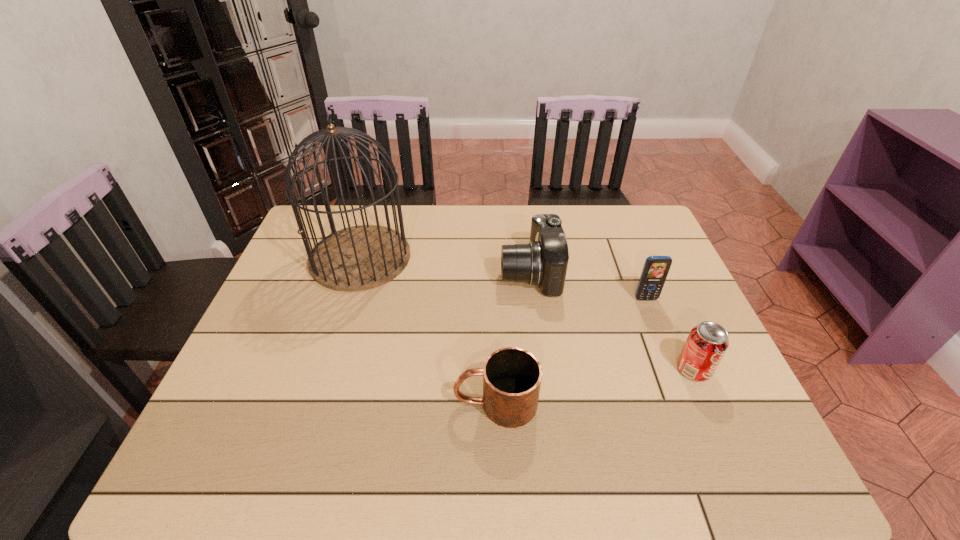
In order to click on birdcage in this screenshot , I will do `click(358, 258)`.

Identify the location of the leftmost object. (358, 258).

Locate an element on the screen. cellular telephone is located at coordinates (656, 268).

Identify the location of camera. Image resolution: width=960 pixels, height=540 pixels. (544, 261).

The height and width of the screenshot is (540, 960). Find the location of `soda can`. soda can is located at coordinates (707, 342).

Locate an element on the screen. Image resolution: width=960 pixels, height=540 pixels. mug is located at coordinates coord(512,376).

Where is `vacant space situated 0.180m at the door of the leftmost object`? The height and width of the screenshot is (540, 960). vacant space situated 0.180m at the door of the leftmost object is located at coordinates (333, 343).

Where is `vacant point located 0.140m on the screen of the cellular telephone`? vacant point located 0.140m on the screen of the cellular telephone is located at coordinates (663, 343).

Image resolution: width=960 pixels, height=540 pixels. I want to click on free space located on the lens of the camera, so click(x=361, y=272).

Find the location of a particular element. The height and width of the screenshot is (540, 960). vacant space located on the lens of the camera is located at coordinates (406, 272).